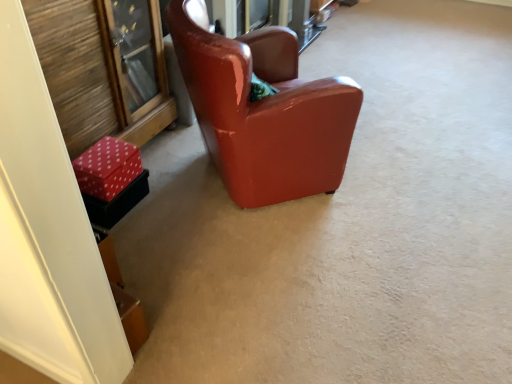
This screenshot has height=384, width=512. Identify the location of glossy leather chair at center. (263, 110).

Measure the distance between glossy leather chair at center and camera.

They are 1.50 meters apart.

What do you see at coordinates (263, 110) in the screenshot?
I see `glossy leather chair at center` at bounding box center [263, 110].

Where is `glossy leather chair at center`? This screenshot has width=512, height=384. glossy leather chair at center is located at coordinates (263, 110).